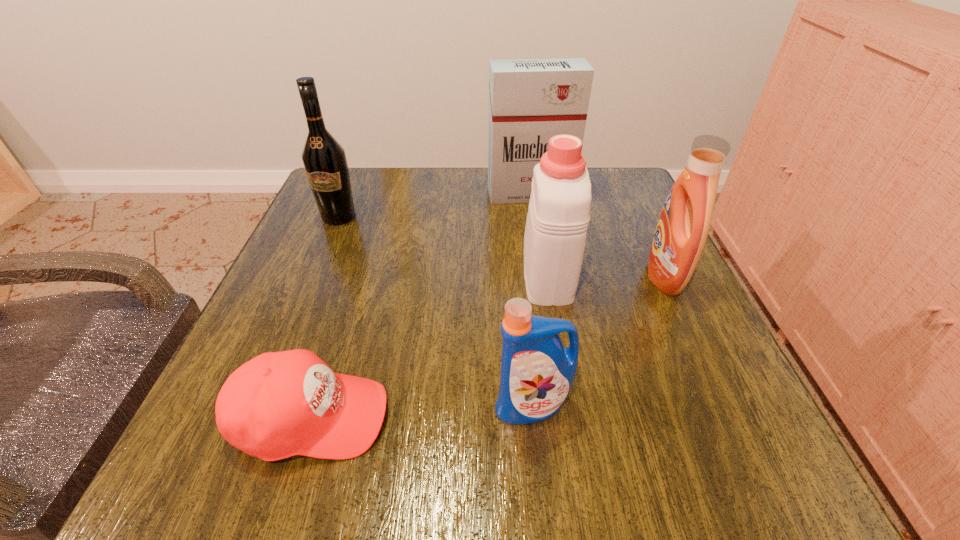
Locate an element on the screen. vacant point located between the baseball cap and the wine bottle is located at coordinates (324, 317).

What are the coordinates of `free space that is in between the farthest object and the baseball cap` in the screenshot? It's located at (420, 306).

This screenshot has height=540, width=960. What are the coordinates of `object that is the third closest one to the fifth tallest object` in the screenshot? It's located at (680, 236).

Where is `object that is the fifth closest to the shortest object`? object that is the fifth closest to the shortest object is located at coordinates (530, 100).

This screenshot has height=540, width=960. Identify the location of detergent that is the third closest to the shortest object. (680, 236).

Identify which detergent is the third nearest to the shortest object. Please provide its 2D coordinates. Your answer should be formatted as a tuple, i.e. [(x, y)], where the tuple contains the x and y coordinates of a point satisfying the conditions above.

[(680, 236)]

Find the location of `vacant region that satisfies the following two spatial constraints: 1. on the front-facing side of the rightmost object; 2. on the label of the nearest detergent`. vacant region that satisfies the following two spatial constraints: 1. on the front-facing side of the rightmost object; 2. on the label of the nearest detergent is located at coordinates (724, 406).